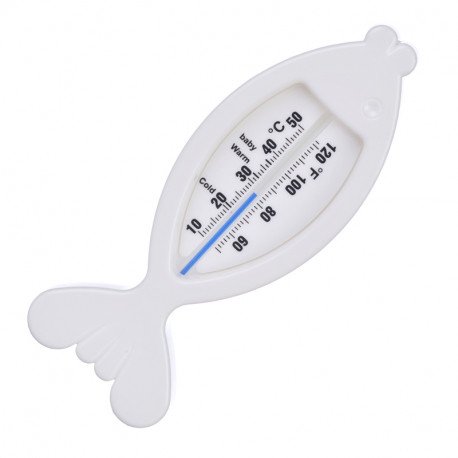
The height and width of the screenshot is (458, 458). I want to click on thermometer, so [x=279, y=170].